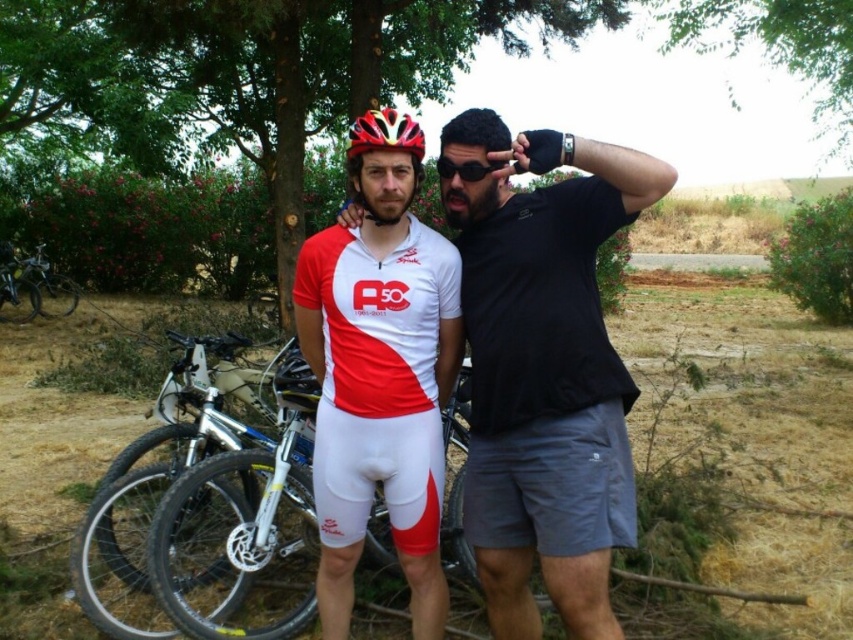
You are planning to take a photo of the matte red and white cycling suit at center and the silver metallic mountain bike at center. Which object should you focus on first if you want to capture both in the frame without moving the camera?

The matte red and white cycling suit at center has a larger size compared to the silver metallic mountain bike at center, so you should focus on the matte red and white cycling suit at center first to ensure it fits properly in the frame before adjusting for the smaller silver metallic mountain bike at center.

You are a photographer trying to capture a wide shot of the silver metallic bicycle at left and the black matte sunglasses at center. Which object should you frame first if you want to ensure both fit in the shot without cropping?

The silver metallic bicycle at left is wider than the black matte sunglasses at center, so you should frame the silver metallic bicycle at left first to ensure both objects fit without cropping.

In the scene shown: You are a photographer trying to capture a clear photo of the silver metallic mountain bike at center. However, the matte red and white cycling suit at center is blocking your view. Can you determine if the bike is fully visible or partially hidden?

The matte red and white cycling suit at center is positioned over the silver metallic mountain bike at center, so the bike is partially hidden.